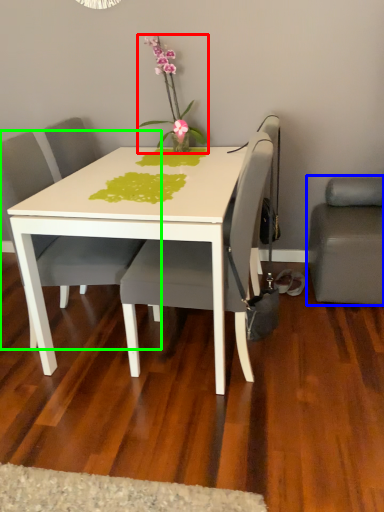
Question: Considering the real-world distances, which object is closest to houseplant (highlighted by a red box)? studio couch (highlighted by a blue box) or chair (highlighted by a green box).

Choices:
 (A) studio couch
 (B) chair

Answer: (B)